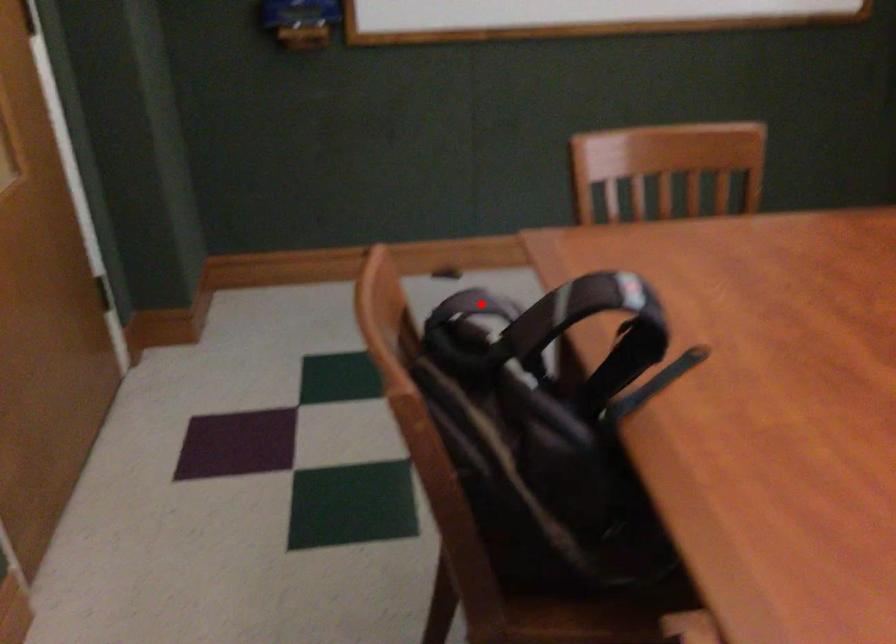
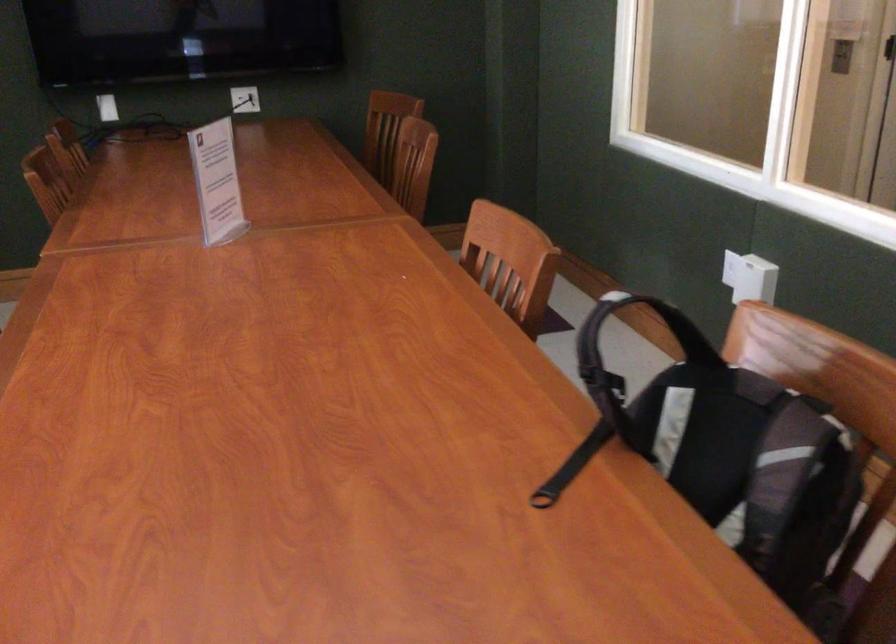
Find the pixel in the second image that matches the highlighted location in the first image.

(796, 456)